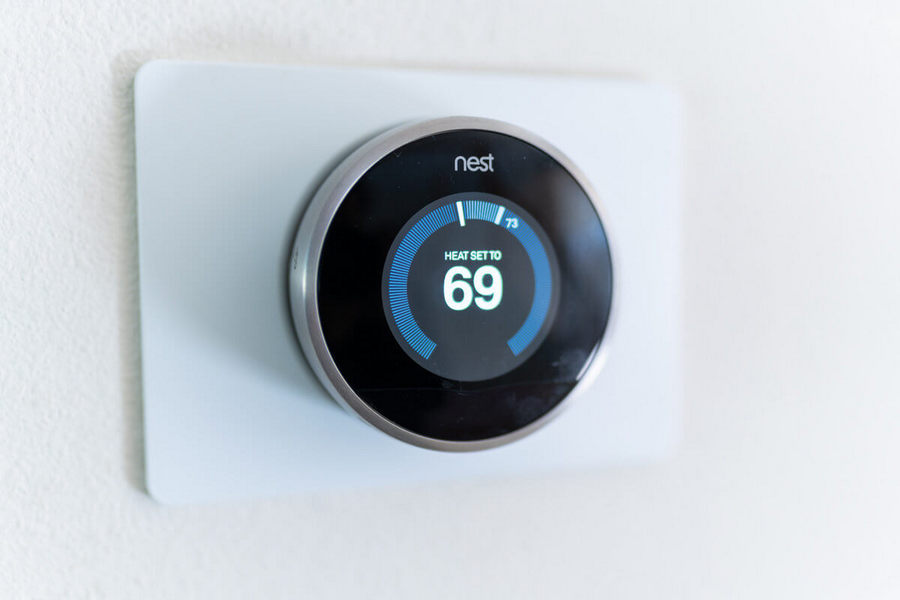
What are the coordinates of `shadow from thermostat` in the screenshot? It's located at point(243,185).